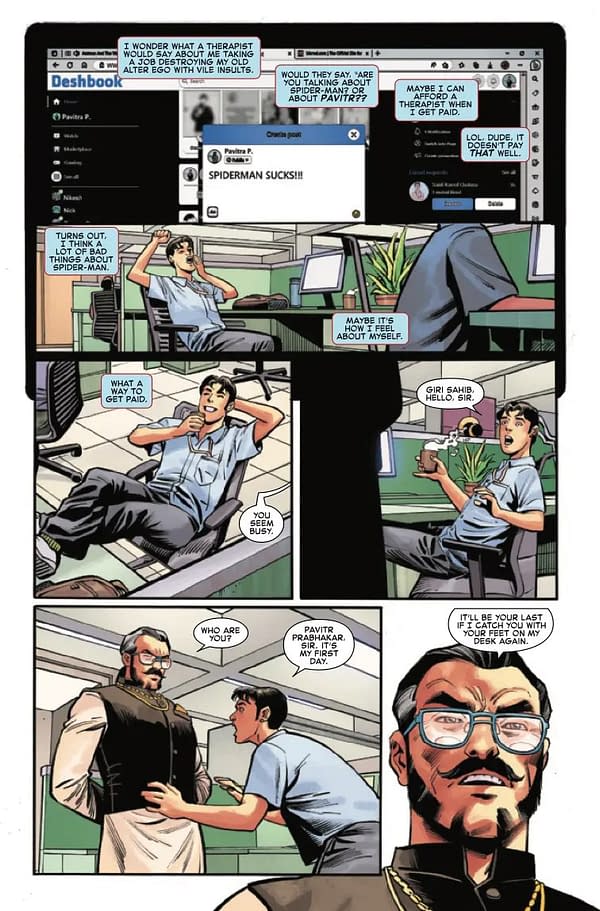
This screenshot has width=600, height=911. In order to click on light in this screenshot , I will do `click(333, 681)`.